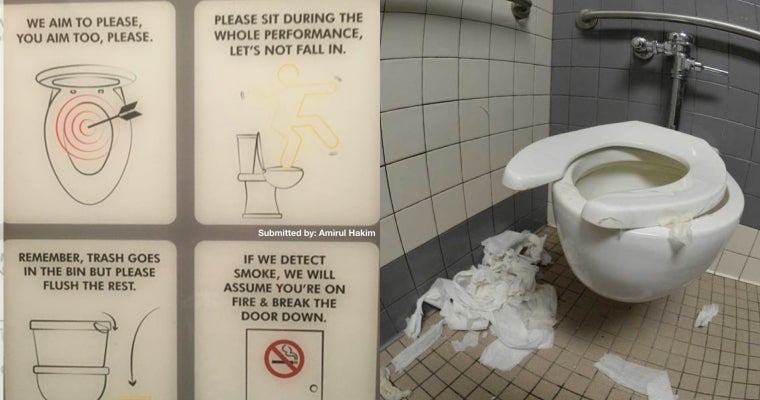
Locate an element on the screen. The image size is (760, 400). toilet is located at coordinates (622, 210).